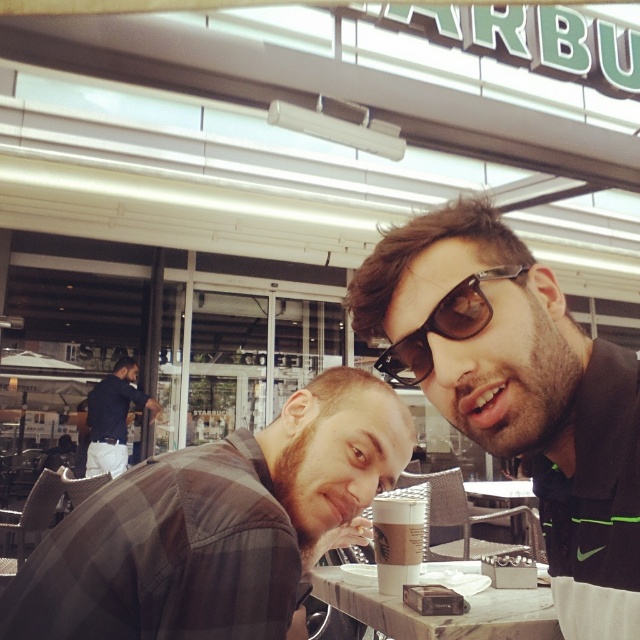
Is brown plaid shirt at center shorter than sunglasses at center?

Yes, brown plaid shirt at center is shorter than sunglasses at center.

Who is taller, brown plaid shirt at center or sunglasses at center?

sunglasses at center

This screenshot has height=640, width=640. I want to click on brown plaid shirt at center, so click(218, 525).

Does brown plaid shirt at center have a larger size compared to marble-patterned table at center?

Indeed, brown plaid shirt at center has a larger size compared to marble-patterned table at center.

Who is higher up, brown plaid shirt at center or marble-patterned table at center?

Positioned higher is brown plaid shirt at center.

Is point (321, 429) positioned after point (541, 595)?

No.

Locate an element on the screen. This screenshot has height=640, width=640. brown plaid shirt at center is located at coordinates (218, 525).

Does sunglasses at center have a lesser height compared to marble-patterned table at center?

Incorrect, sunglasses at center's height does not fall short of marble-patterned table at center's.

In the scene shown: How distant is sunglasses at center from marble-patterned table at center?

52.45 centimeters

Locate an element on the screen. The height and width of the screenshot is (640, 640). sunglasses at center is located at coordinates (518, 392).

Locate an element on the screen. The width and height of the screenshot is (640, 640). sunglasses at center is located at coordinates (518, 392).